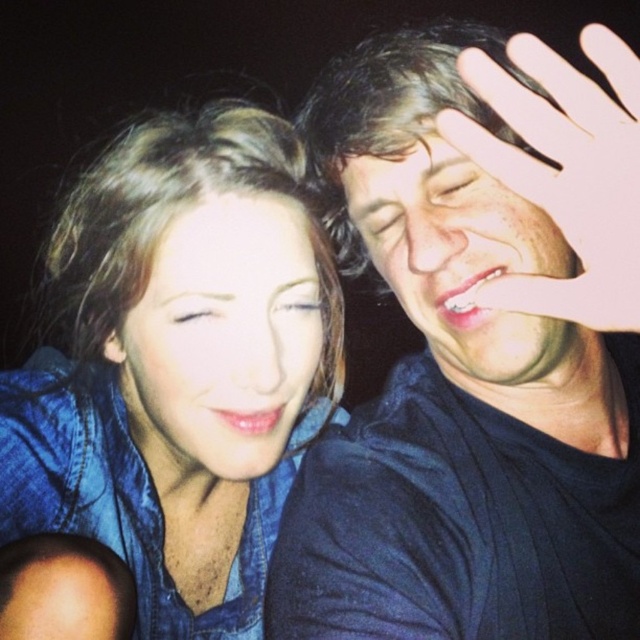
You are standing 30 inches away from a point in the image. Is the point closer to you than the point at coordinates point (529, 381)?

The distance of point (529, 381) from viewer is 31.77 inches, so the point at coordinates point (529, 381) is farther away than the point you are standing at 30 inches.

You are a photographer trying to edit this image. You want to add a decorative border around the matte black shirt at right and the denim shirt at left. Which shirt should you place the border around first if you want to start with the one that is higher in the image?

The matte black shirt at right is above the denim shirt at left, so you should place the border around the matte black shirt at right first since it is higher in the image.